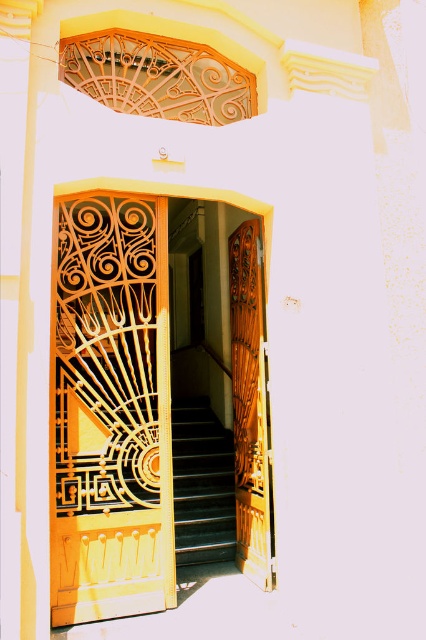
You are standing at the entrance of the building and want to go upstairs. The wooden carved door at center is in your way. Can you move around it to reach the black glossy stairs at center?

The wooden carved door at center is to the right of black glossy stairs at center, so you can move to the left side of the wooden carved door at center to reach the black glossy stairs at center.

In the scene shown: You are standing at the entrance of the building and notice two points marked on the doors. The first point is at coordinates point (126, 225) and the second is at point (256, 436). Which point is closer to you as you face the entrance?

Point (126, 225) is in front of point (256, 436), so the first point is closer to you as you face the entrance.

You are a delivery person with a box that is 1.5 meters long. You need to move it from the wooden carved door at center to the black glossy stairs at center. Can you carry the box through the space between them without tilting it?

The wooden carved door at center and black glossy stairs at center are 1.27 meters apart. Since the box is 1.5 meters long, it cannot be carried through the space between them without tilting, as the distance is shorter than the box length.